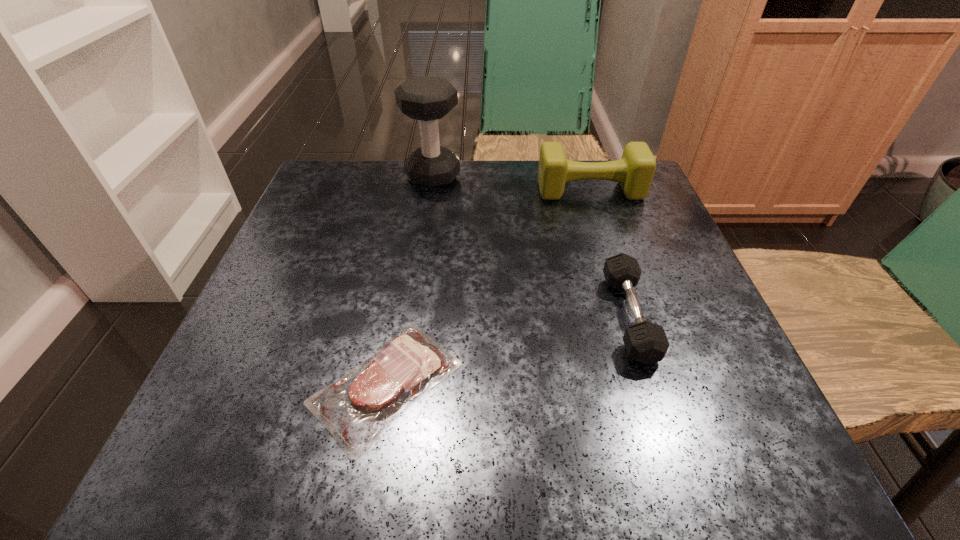
You are a GUI agent. You are given a task and a screenshot of the screen. Output one action in this format:
    pyautogui.click(x=<x>, y=<y>)
    Task: Click on the vacant space at the near right corner of the desktop
    
    Given the screenshot: What is the action you would take?
    pyautogui.click(x=689, y=433)

Find the location of a particular element. Image resolution: width=960 pixels, height=540 pixels. free space between the leftmost dumbbell and the second shortest object is located at coordinates (531, 246).

Where is `free point between the shortest dumbbell and the tallest object`? free point between the shortest dumbbell and the tallest object is located at coordinates (531, 246).

Image resolution: width=960 pixels, height=540 pixels. What are the coordinates of `vacant area that lies between the second shortest dumbbell and the steak` in the screenshot? It's located at (488, 287).

Where is `vacant space that's between the shortest dumbbell and the second tallest dumbbell`? vacant space that's between the shortest dumbbell and the second tallest dumbbell is located at coordinates (610, 253).

I want to click on free area in between the second shortest object and the leftmost dumbbell, so click(x=531, y=246).

Find the location of a particular element. The height and width of the screenshot is (540, 960). empty space between the steak and the nearest dumbbell is located at coordinates (508, 349).

Where is `vacant area between the nearest dumbbell and the second shortest dumbbell`? The height and width of the screenshot is (540, 960). vacant area between the nearest dumbbell and the second shortest dumbbell is located at coordinates (610, 253).

This screenshot has height=540, width=960. I want to click on vacant area that lies between the tallest object and the third tallest object, so click(531, 246).

Where is `free space between the second shortest object and the third shortest object`? Image resolution: width=960 pixels, height=540 pixels. free space between the second shortest object and the third shortest object is located at coordinates (610, 253).